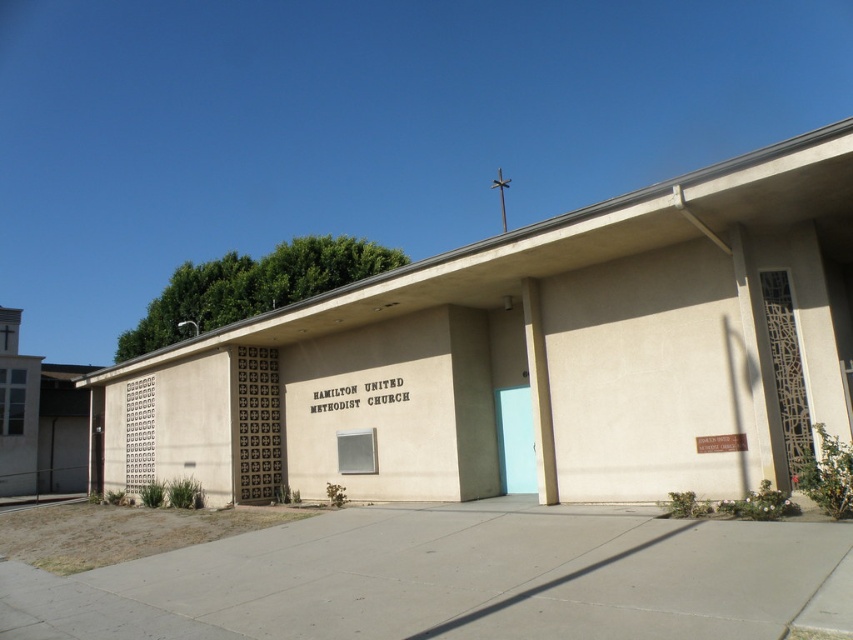
Does brown textured door at center have a greater height compared to light blue matte door at center?

Indeed, brown textured door at center has a greater height compared to light blue matte door at center.

This screenshot has width=853, height=640. Identify the location of brown textured door at center. (257, 426).